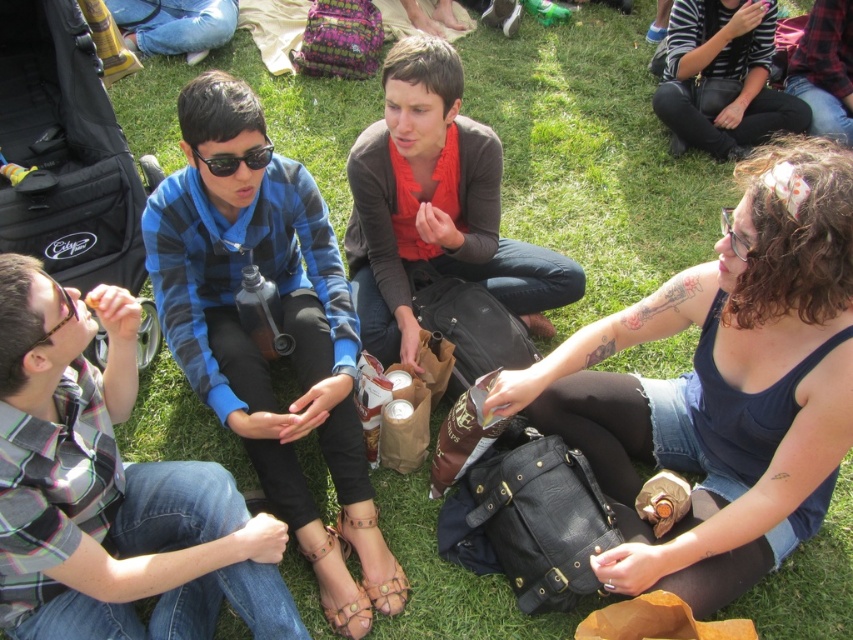
You are a photographer trying to capture a candid shot of the two people at the upper right. You want to frame the shot so that the striped knit sweater at upper right is on the left side of the frame and the red plaid shirt at upper right is on the right side. Is this possible based on their current positions?

Yes, because the striped knit sweater at upper right is already positioned to the left of the red plaid shirt at upper right, which aligns with your desired framing.

What object is located at the point with coordinates (825, 68)?

The point at coordinates (825, 68) marks the red plaid shirt at upper right.